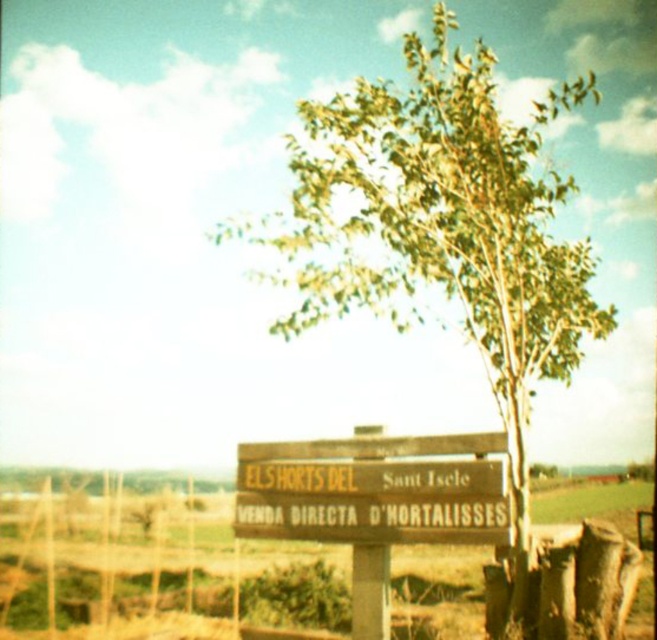
You are standing at the center of the image and want to walk towards the green leafy tree at center. Which direction should you move?

Since the green leafy tree at center is located at coordinates point (442, 227), you should move towards the lower right direction to reach it.

You are standing in a rural area and see the point marked at coordinate (112, 568). What object is located at that point?

The point at coordinate (112, 568) marks the brown wooden signpost at center.